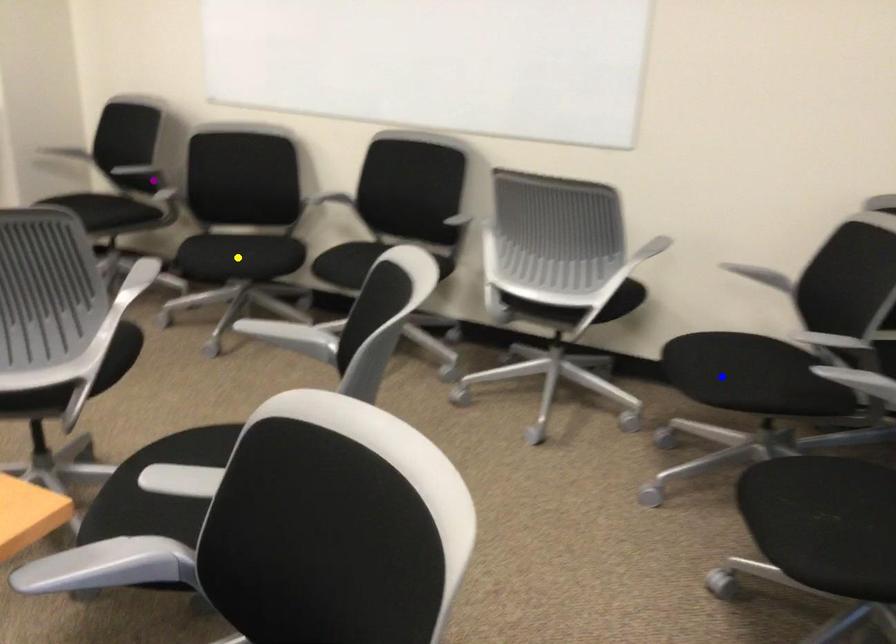
Order these from nearest to farthest:
1. purple point
2. yellow point
3. blue point

blue point
purple point
yellow point